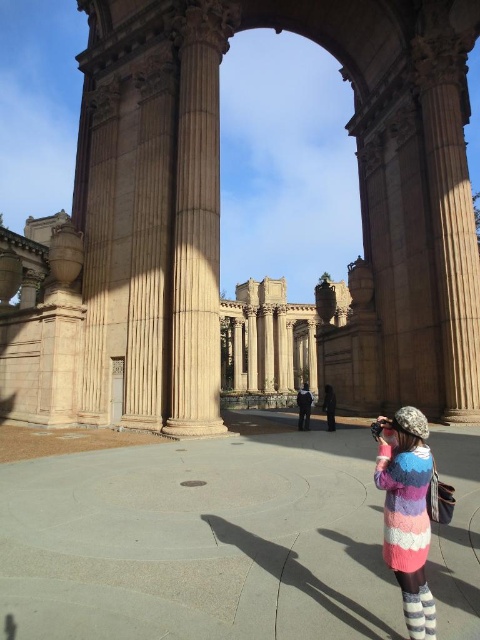
Does sandy beige stone column at center appear under dark blue fabric jacket at center?

Actually, sandy beige stone column at center is above dark blue fabric jacket at center.

Is sandy beige stone column at center wider than dark blue fabric jacket at center?

No.

Identify the location of sandy beige stone column at center. The height and width of the screenshot is (640, 480). (197, 221).

Which is in front, point (440, 180) or point (324, 396)?

Point (440, 180) is in front.

Between brown stone ruins at center and dark woolen sweater at center, which one is positioned lower?

dark woolen sweater at center is below.

Between point (12, 412) and point (327, 410), which one is positioned behind?

Positioned behind is point (12, 412).

Identify the location of brown stone ruins at center. (218, 211).

What do you see at coordinates (407, 512) in the screenshot?
I see `multicolored knitted sweater at lower right` at bounding box center [407, 512].

Who is taller, multicolored knitted sweater at lower right or dark blue fabric jacket at center?

Standing taller between the two is dark blue fabric jacket at center.

Does point (394, 520) come in front of point (299, 413)?

Yes, it is in front of point (299, 413).

Where is `multicolored knitted sweater at lower right`? The image size is (480, 640). multicolored knitted sweater at lower right is located at coordinates (407, 512).